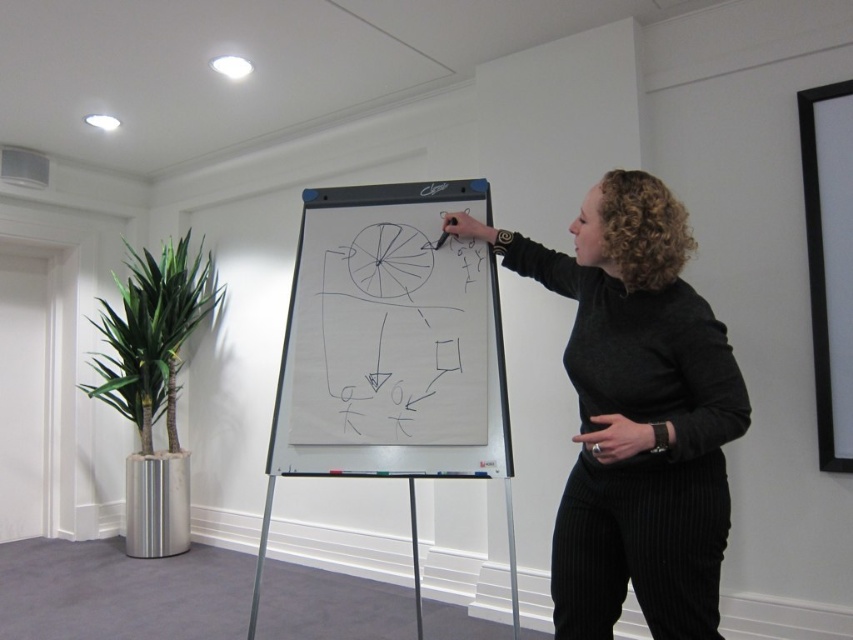
Question: Can you confirm if black matte sweater at center is thinner than whiteboard at center?

Choices:
 (A) yes
 (B) no

Answer: (A)

Question: Which point is farther to the camera?

Choices:
 (A) black matte sweater at center
 (B) whiteboard at center

Answer: (B)

Question: Which of the following is the farthest from the observer?

Choices:
 (A) (498, 396)
 (B) (595, 561)

Answer: (A)

Question: Can you confirm if black matte sweater at center is smaller than whiteboard at center?

Choices:
 (A) no
 (B) yes

Answer: (A)

Question: Is black matte sweater at center to the right of whiteboard at center from the viewer's perspective?

Choices:
 (A) yes
 (B) no

Answer: (A)

Question: Which object appears farthest from the camera in this image?

Choices:
 (A) black matte sweater at center
 (B) whiteboard at center

Answer: (B)